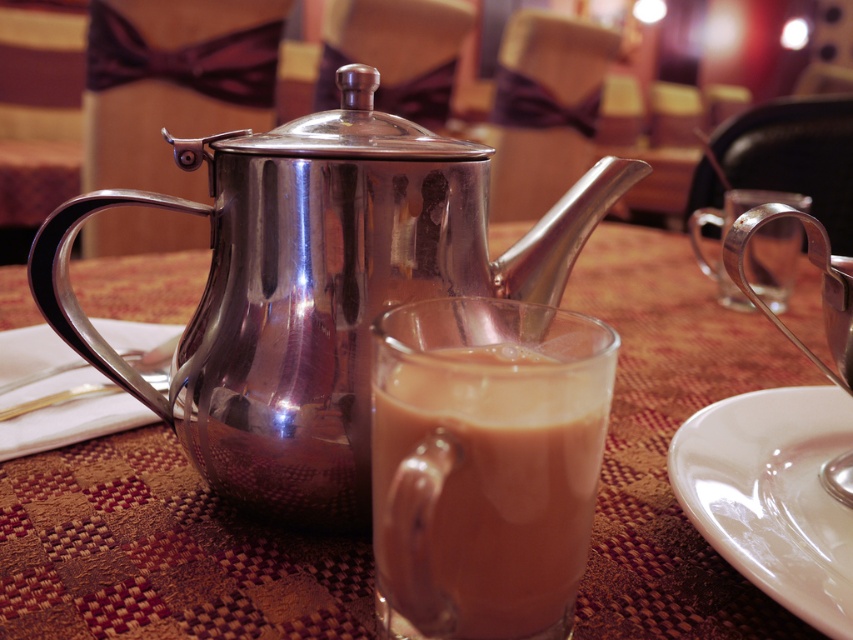
Question: From the image, what is the correct spatial relationship of polished metal teapot at center in relation to brown frothy liquid at center?

Choices:
 (A) right
 (B) left

Answer: (B)

Question: Which point is closer to the camera taking this photo?

Choices:
 (A) (695, 404)
 (B) (317, 477)
 (C) (776, 500)

Answer: (B)

Question: Which is farther from the white glossy saucer at lower right?

Choices:
 (A) brushed metal teapot at center
 (B) brown frothy liquid at center
 (C) polished metal teapot at center

Answer: (A)

Question: Is brown frothy liquid at center above white glossy saucer at lower right?

Choices:
 (A) no
 (B) yes

Answer: (B)

Question: Which of the following is the farthest from the observer?

Choices:
 (A) white glossy saucer at lower right
 (B) polished metal teapot at center
 (C) brushed metal teapot at center
 (D) brown frothy liquid at center

Answer: (B)

Question: Is brushed metal teapot at center below white glossy saucer at lower right?

Choices:
 (A) no
 (B) yes

Answer: (A)